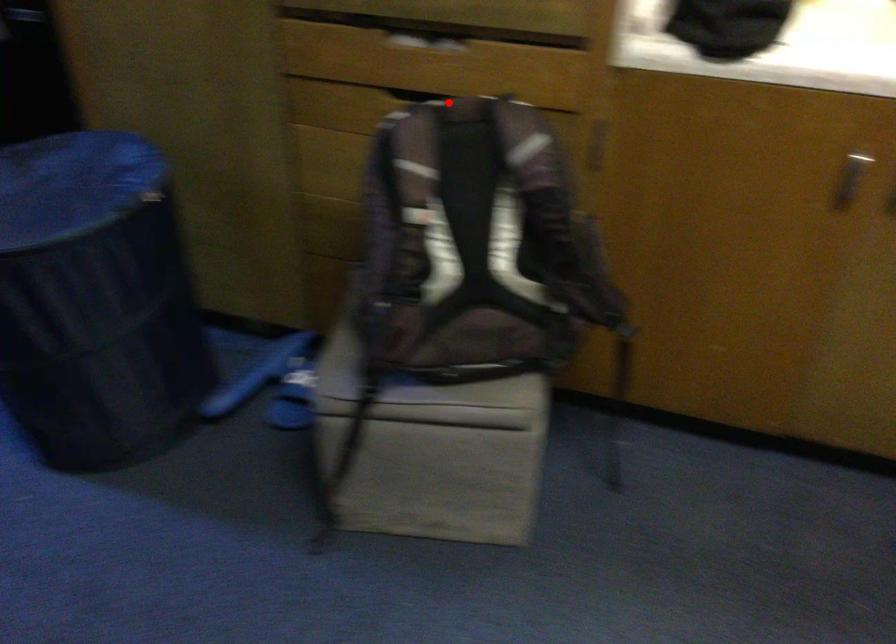
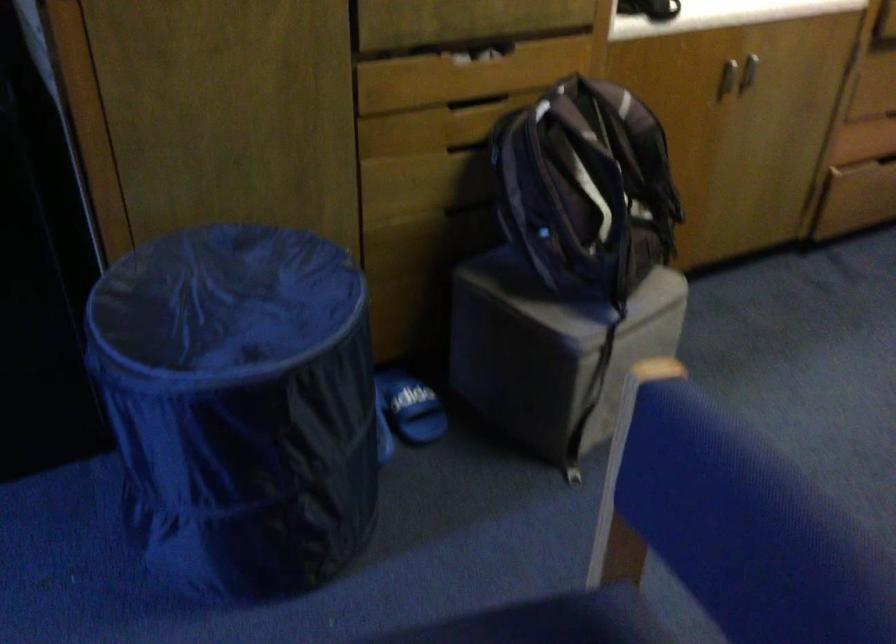
Question: I am providing you with two images of the same scene from different viewpoints. Given a red point in image1, look at the same physical point in image2. Is it:

Choices:
 (A) Closer to the viewpoint
 (B) Farther from the viewpoint

Answer: (B)